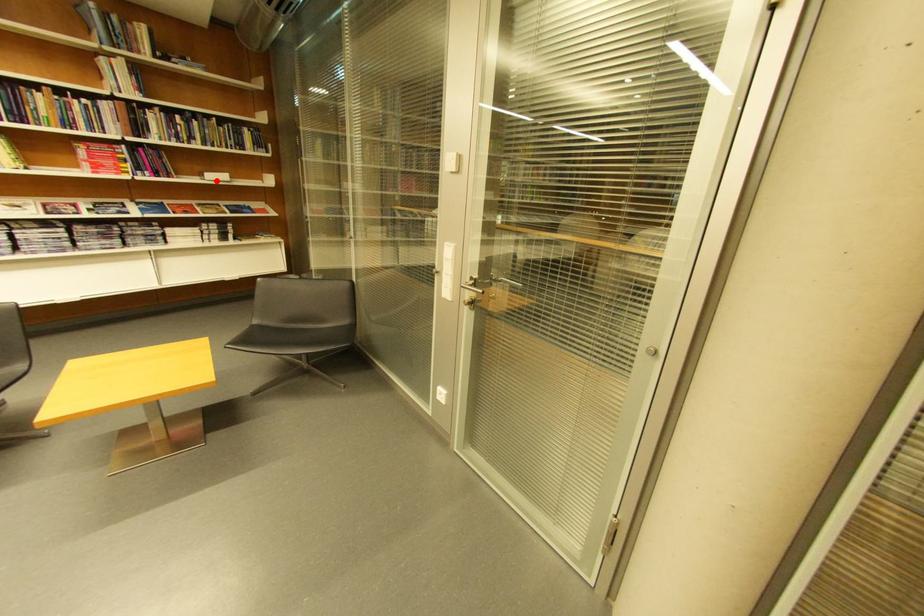
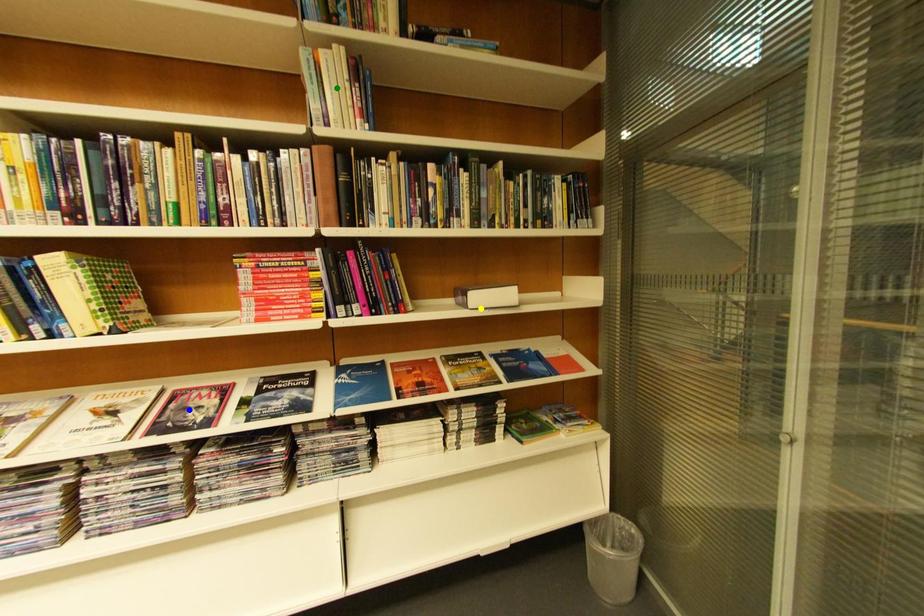
Question: I am providing you with two images of the same scene from different viewpoints. A red point is marked on the first image. You are given multiple points on the second image. Which point in image 2 represents the same 3d spot as the red point in image 1?

Choices:
 (A) green point
 (B) yellow point
 (C) blue point

Answer: (B)